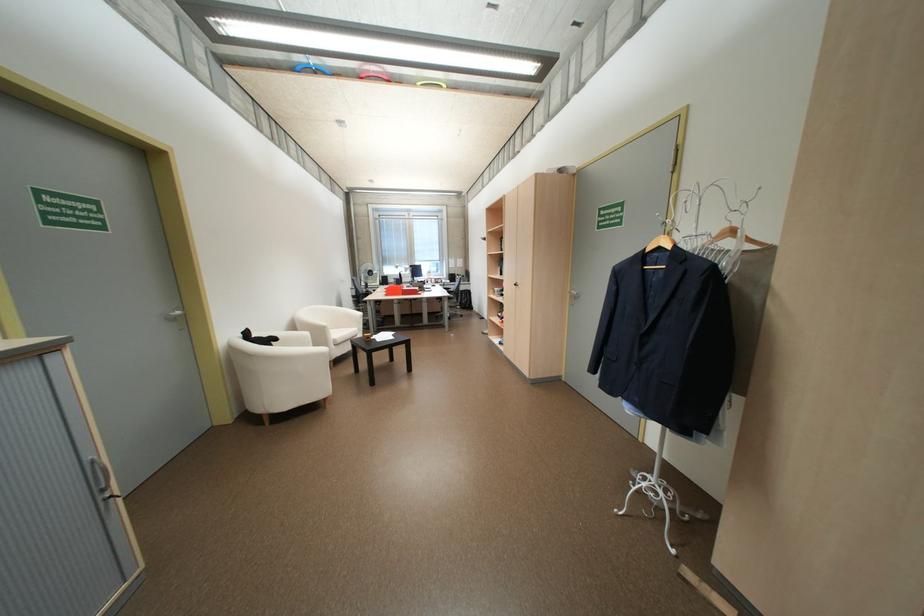
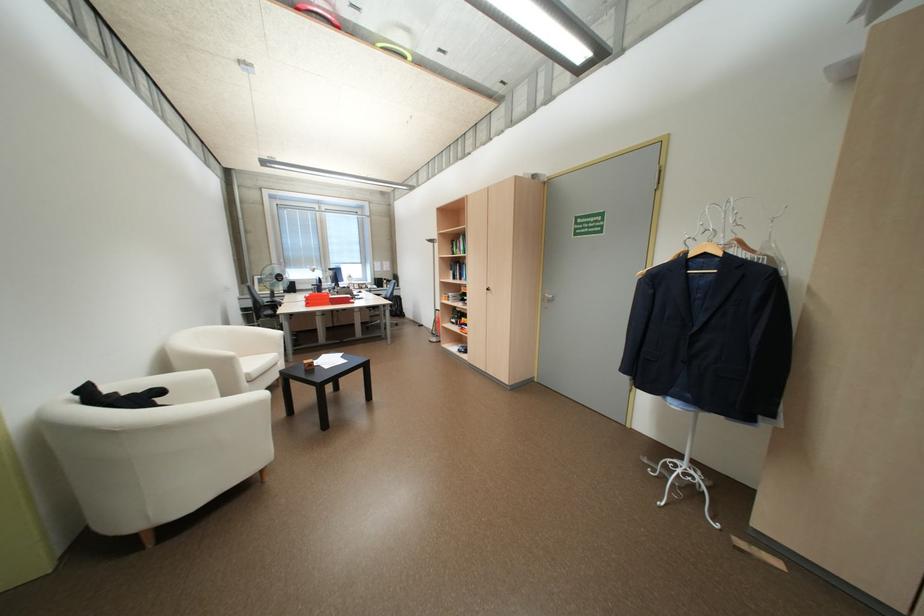
Where in the second image is the point corresponding to the point at 285,339 from the first image?

(169, 392)